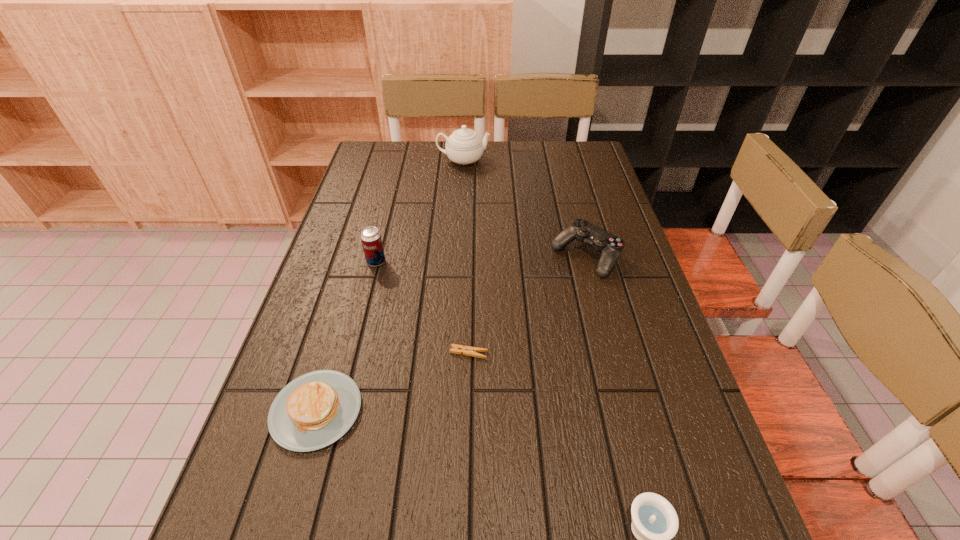
In the image, there is a desktop. Where is `vacant area at the far left corner`? vacant area at the far left corner is located at coordinates (383, 166).

At what (x,y) coordinates should I click in order to perform the action: click on free region at the far right corner. Please return your answer as a coordinate pair (x, y). Looking at the image, I should click on pyautogui.click(x=579, y=166).

Identify the location of free space between the chinaware and the third tallest object. (525, 208).

Locate an element on the screen. The image size is (960, 540). free space that is in between the clothespin and the control is located at coordinates (528, 305).

Find the location of a particular element. The height and width of the screenshot is (540, 960). unoccupied position between the farthest object and the pancake is located at coordinates (390, 286).

The height and width of the screenshot is (540, 960). Identify the location of free area in between the third tallest object and the beer can. (481, 259).

This screenshot has width=960, height=540. In order to click on free space between the control and the farthest object in this screenshot , I will do `click(525, 208)`.

Find the location of `vacant space that's between the farthest object and the third nearest object`. vacant space that's between the farthest object and the third nearest object is located at coordinates (467, 257).

Where is `free space between the fifth farthest object and the fifth shortest object`? The height and width of the screenshot is (540, 960). free space between the fifth farthest object and the fifth shortest object is located at coordinates (347, 336).

Select which object is the second closest to the beer can. Please provide its 2D coordinates. Your answer should be formatted as a tuple, i.e. [(x, y)], where the tuple contains the x and y coordinates of a point satisfying the conditions above.

[(313, 411)]